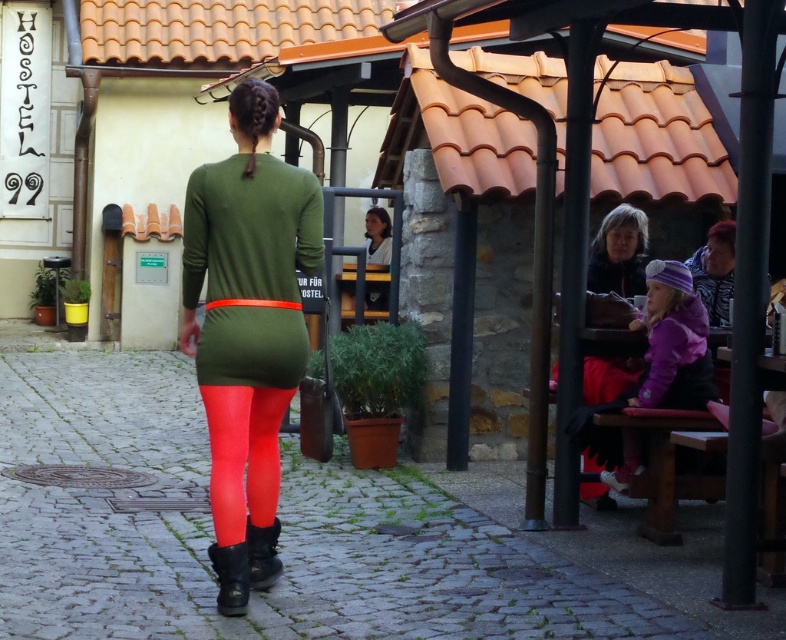
You are a photographer trying to capture the woman in the scene. You want to ensure the matte green dress at center is visible without being blocked by the leather boot at lower center. Is the dress currently positioned in a way that allows this?

Yes, the matte green dress at center is in front of the leather boot at lower center, so it is not blocked and remains visible.

You are a traveler who just arrived at the square and see the purple fleece jacket at lower right and the leather boot at center. Which object is closer to the right edge of the image?

The purple fleece jacket at lower right is to the right of the leather boot at center, so it is closer to the right edge of the image.

You are a tailor who needs to determine which item requires more fabric for a custom order between the matte black jacket at upper right and the leather boot at lower center. Based on their sizes, which one would need more fabric?

The matte black jacket at upper right requires more fabric because its width is larger than that of the leather boot at lower center.